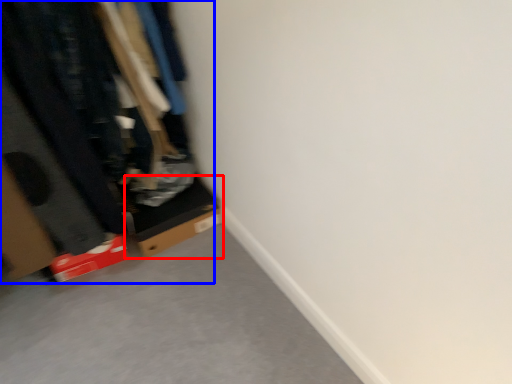
Question: Which object is closer to the camera taking this photo, cardboard box (highlighted by a red box) or closet (highlighted by a blue box)?

Choices:
 (A) cardboard box
 (B) closet

Answer: (B)